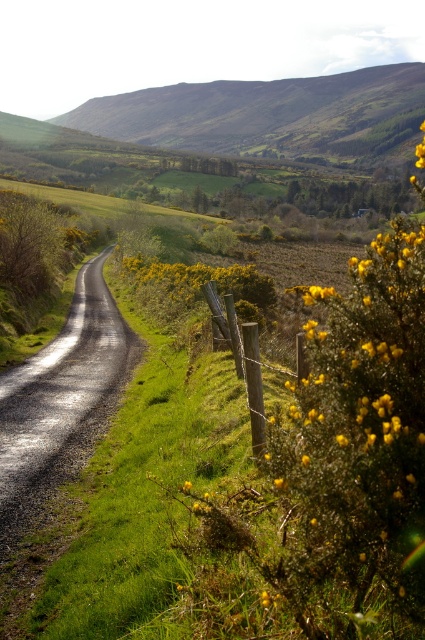
You are a hiker standing at the wooden post at center. Looking towards the green grassy hillside at upper center, do you think you can see the top of the hill from your current position?

The green grassy hillside at upper center is taller than the wooden post at center, so yes, you can see the top of the hill from the wooden post at center because the hill is higher than the post.

You are standing at the starting point of the road and want to reach the end of the road. Which point, point (379,67) or point (252,401), is closer to the end of the road?

Point (379,67) is behind point (252,401), so point (379,67) is closer to the end of the road.